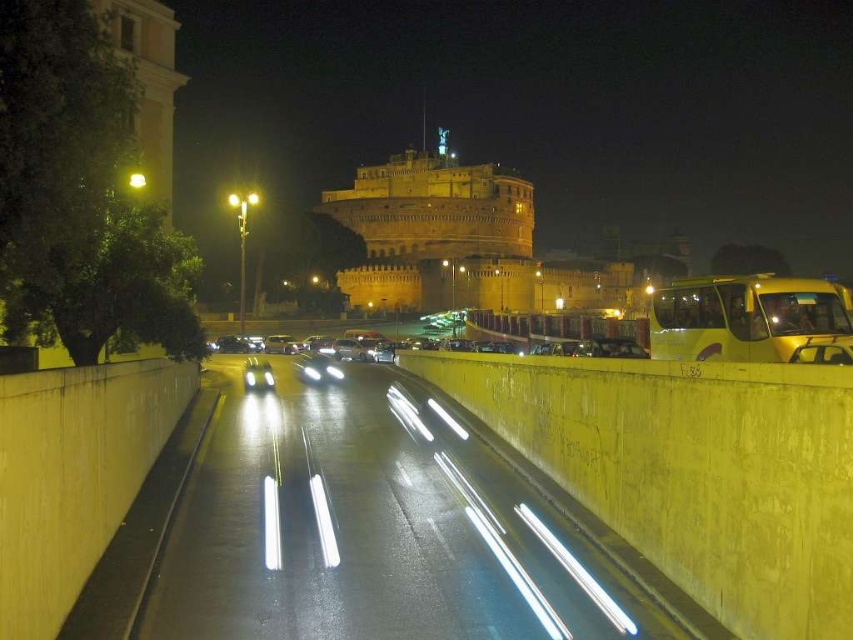
Does yellow concrete highway at center have a larger size compared to yellow matte bus at right?

Yes, yellow concrete highway at center is bigger than yellow matte bus at right.

Does yellow concrete highway at center have a greater width compared to yellow matte bus at right?

Indeed, yellow concrete highway at center has a greater width compared to yellow matte bus at right.

Does point (347, 544) come closer to viewer compared to point (648, 336)?

That is True.

You are a GUI agent. You are given a task and a screenshot of the screen. Output one action in this format:
    pyautogui.click(x=<x>, y=<y>)
    Task: Click on the yellow concrete highway at center
    This screenshot has width=853, height=640.
    Given the screenshot: What is the action you would take?
    pyautogui.click(x=372, y=529)